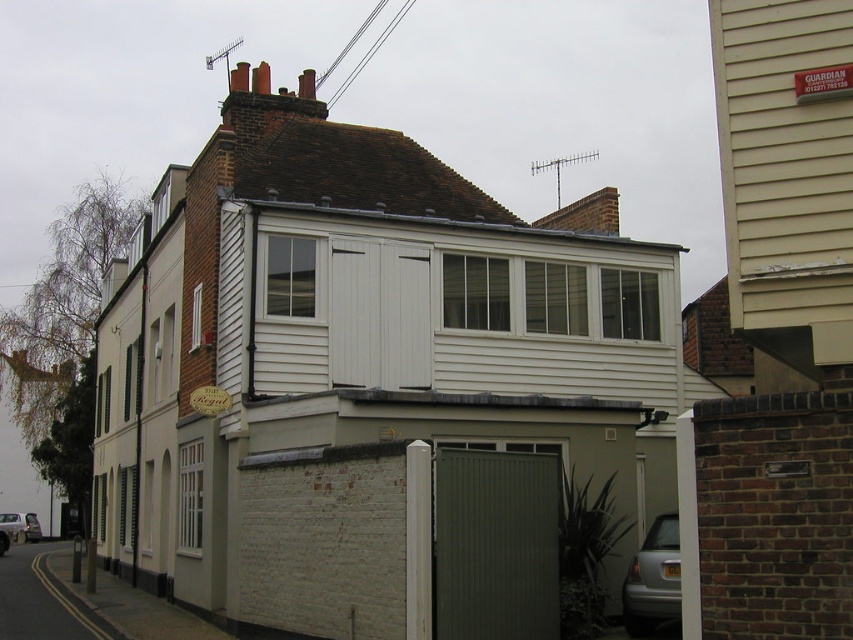
You are a delivery person trying to park your van in the driveway next to the white wood shed at center and the dark green corrugated metal at center. Can you safely park your van without hitting either object if your van is 2.5 meters tall?

The white wood shed at center is taller than dark green corrugated metal at center. Since the shed is taller, but the exact height isn not provided, it is uncertain whether the van will hit. However, if the shed is taller than the van, then parking might be safe. Without specific measurements, it is recommended to avoid parking too close to the taller shed to prevent potential damage.

You are a delivery person trying to park your van in the driveway next to the white wood shed at center and the dark green corrugated metal at center. Which object should you park closer to if you want to maximize space for future vehicles?

You should park closer to the dark green corrugated metal at center because the white wood shed at center is wider, so leaving more space near the narrower dark green corrugated metal at center allows for better vehicle maneuvering.